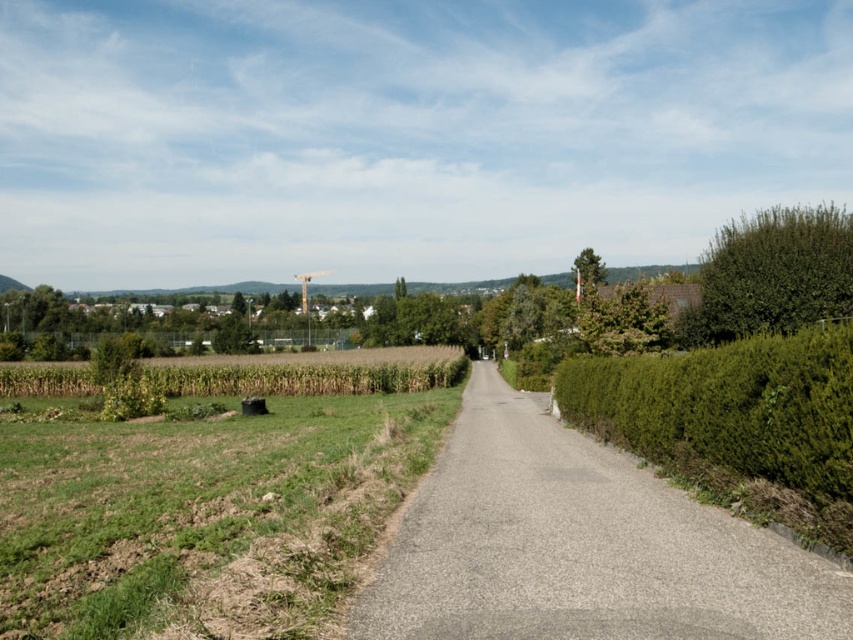
You are standing on the paved path in the center of the scene. You see the green leafy hedge at right and the green leafy bush at right. Which one is nearer to you?

The green leafy hedge at right is closer to the viewer than the green leafy bush at right.

You are standing at the starting point of the paved path in this rural scene. You see a gray asphalt road at center marked by point [579,547]. If you walk straight ahead along the path, will you eventually reach the construction crane in the distance?

Yes, walking straight ahead along the gray asphalt road at center marked by point [579,547] will lead you towards the construction crane in the distance as the path runs through the center towards the horizon where the crane is located.

You are a delivery driver approaching the gray asphalt road at center and the green leafy hedge at right. Which object is closer to you as you drive along the path?

The gray asphalt road at center is positioned under the green leafy hedge at right, meaning the hedge is closer to you than the road. Therefore, the green leafy hedge at right is closer to you as you drive along the path.